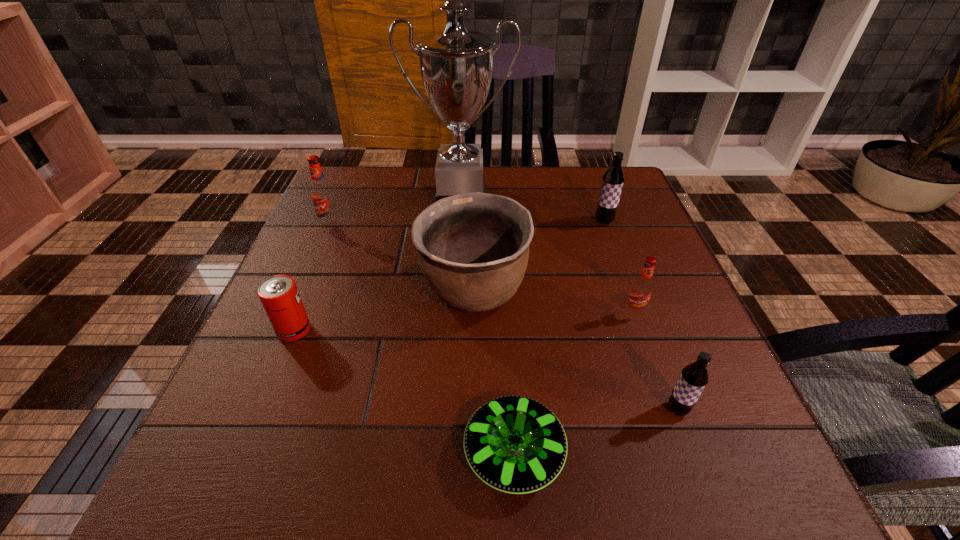
Locate an element on the screen. free spot between the pottery and the farther red root beer is located at coordinates (401, 258).

This screenshot has height=540, width=960. What are the coordinates of `free space between the leftmost root beer and the green saucer` in the screenshot? It's located at (422, 339).

Locate an element on the screen. Image resolution: width=960 pixels, height=540 pixels. free space between the trophy cup and the second shortest object is located at coordinates (377, 264).

At what (x,y) coordinates should I click in order to perform the action: click on free space between the smaller red root beer and the can. Please return your answer as a coordinate pair (x, y). This screenshot has width=960, height=540. Looking at the image, I should click on (464, 321).

Identify the location of vacant area that lies between the second shortest object and the nearest root beer. Image resolution: width=960 pixels, height=540 pixels. (486, 370).

You are a GUI agent. You are given a task and a screenshot of the screen. Output one action in this format:
    pyautogui.click(x=<x>, y=<y>)
    Task: Click on the vacant space that is in between the tallest object and the seventh tallest object
    This screenshot has width=960, height=540.
    Given the screenshot: What is the action you would take?
    pyautogui.click(x=377, y=264)

Find the location of a particular element. This screenshot has width=960, height=540. free point between the second nearest root beer and the tallest object is located at coordinates (547, 255).

You are a GUI agent. You are given a task and a screenshot of the screen. Output one action in this format:
    pyautogui.click(x=<x>, y=<y>)
    Task: Click on the object that is the fourth closest to the pottery
    The width and height of the screenshot is (960, 540).
    Given the screenshot: What is the action you would take?
    pyautogui.click(x=279, y=295)

The height and width of the screenshot is (540, 960). What are the coordinates of `object that stands as the fourth closest to the second shortest object` in the screenshot? It's located at (456, 65).

Where is `root beer that is the third nearest to the bigger brown root beer`? Image resolution: width=960 pixels, height=540 pixels. root beer that is the third nearest to the bigger brown root beer is located at coordinates (322, 195).